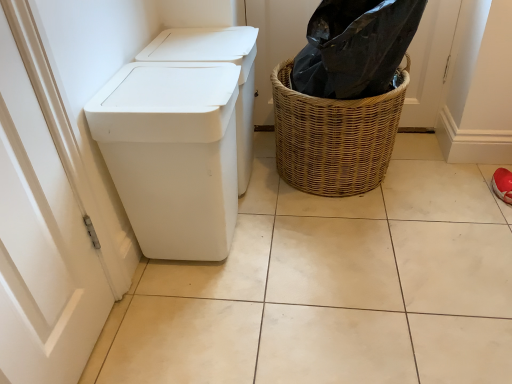
This screenshot has width=512, height=384. I want to click on free space in front of white plastic waste container at left, so click(x=194, y=315).